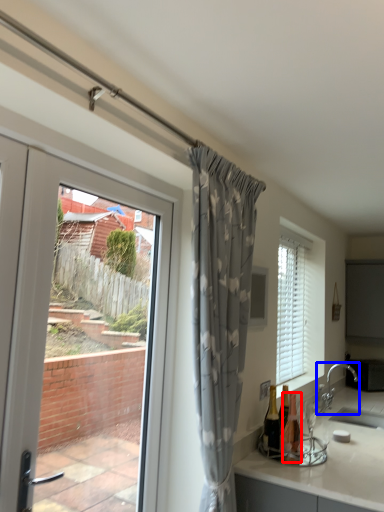
Question: Among these objects, which one is nearest to the camera, bottle (highlighted by a red box) or tap (highlighted by a blue box)?

Choices:
 (A) bottle
 (B) tap

Answer: (A)